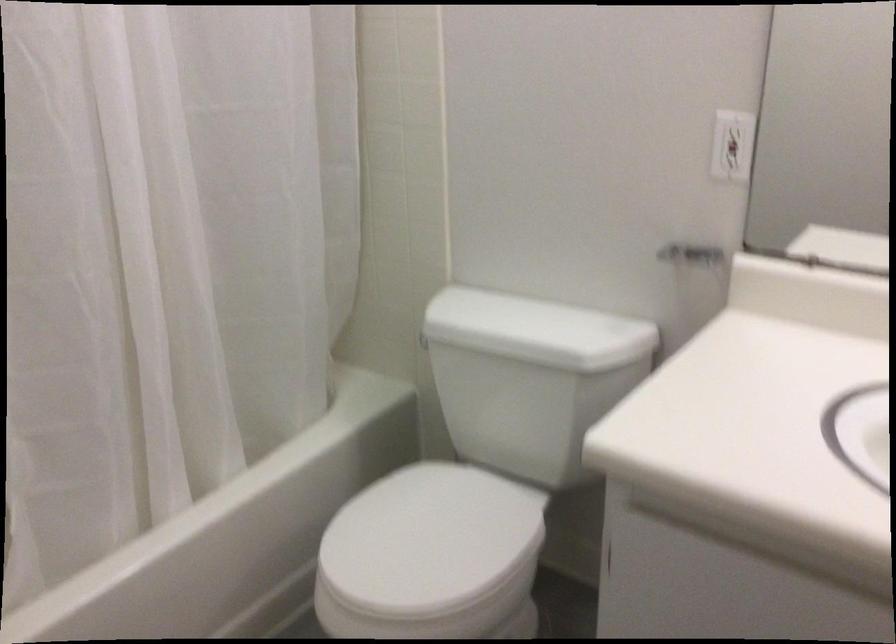
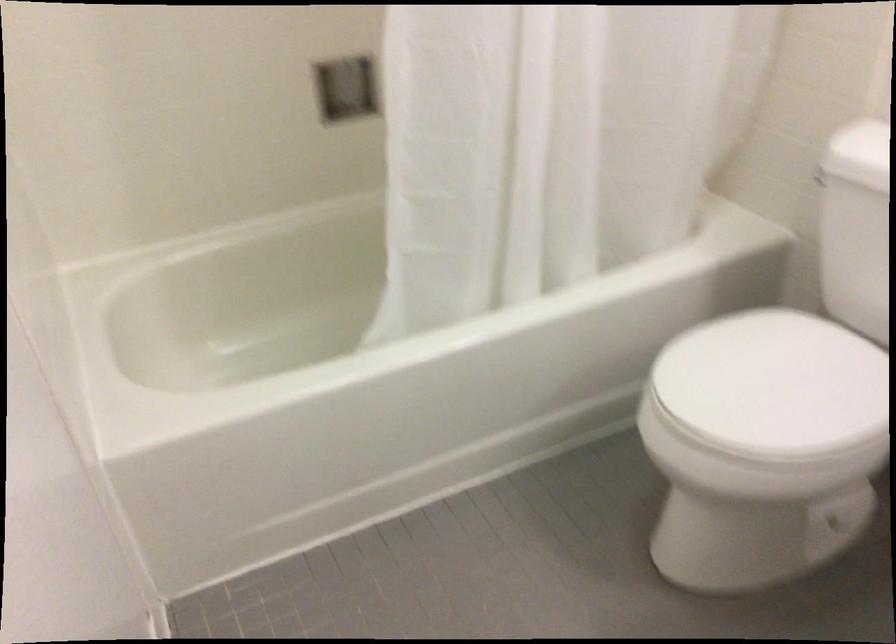
Question: The camera is either moving clockwise (left) or counter-clockwise (right) around the object. The first image is from the beginning of the video and the second image is from the end. Is the camera moving left or right when shooting the video?

Choices:
 (A) Left
 (B) Right

Answer: (B)